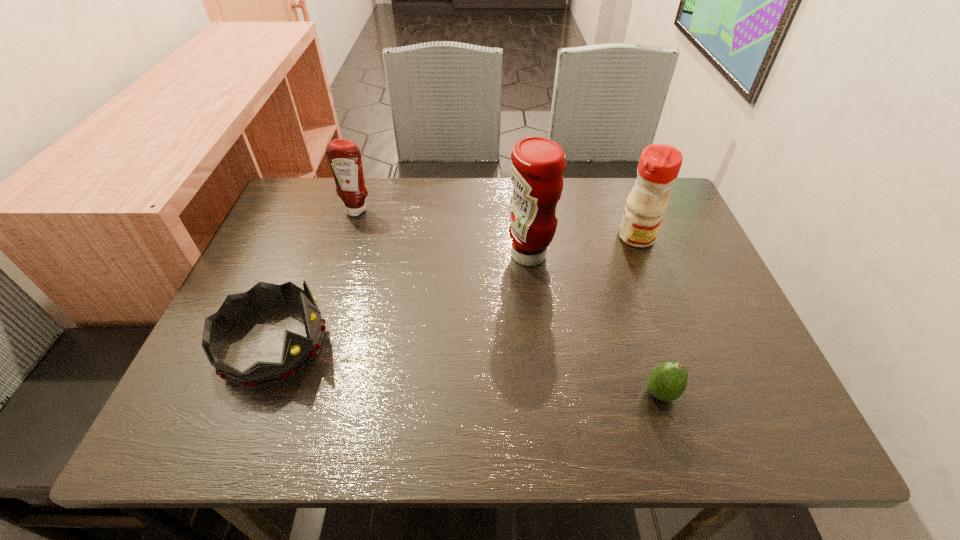
The height and width of the screenshot is (540, 960). In order to click on vacant space at the near left corner in this screenshot , I will do `click(254, 443)`.

Find the location of a particular element. free space at the far right corner is located at coordinates (620, 178).

Locate an element on the screen. The width and height of the screenshot is (960, 540). blank region between the second shortest object and the third object from left to right is located at coordinates (401, 299).

Where is `vacant area that lies between the tiara and the third shortest object`? The height and width of the screenshot is (540, 960). vacant area that lies between the tiara and the third shortest object is located at coordinates (315, 277).

Locate an element on the screen. This screenshot has height=540, width=960. free spot between the farthest object and the avocado is located at coordinates (509, 301).

The image size is (960, 540). I want to click on vacant region between the tiara and the second condiment from right to left, so click(x=401, y=299).

The height and width of the screenshot is (540, 960). I want to click on free area in between the shortest object and the tiara, so click(467, 368).

This screenshot has width=960, height=540. I want to click on vacant space that's between the rightmost condiment and the second shortest object, so coord(455,290).

Locate an element on the screen. This screenshot has height=540, width=960. free space between the avocado and the leftmost condiment is located at coordinates (509, 301).

Locate an element on the screen. empty location between the third object from left to right and the avocado is located at coordinates (594, 324).